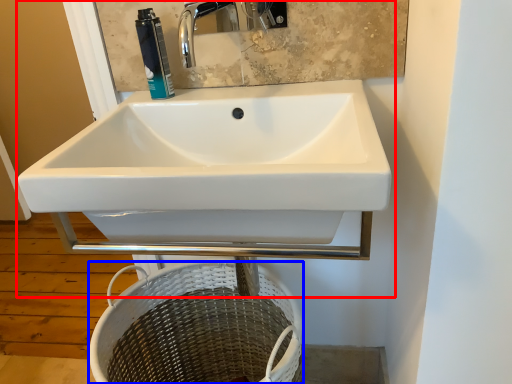
Question: Which object appears farthest to the camera in this image, sink (highlighted by a red box) or basket (highlighted by a blue box)?

Choices:
 (A) sink
 (B) basket

Answer: (B)